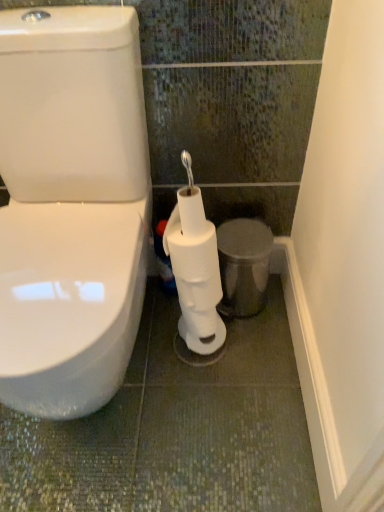
Locate an element on the screen. This screenshot has height=512, width=384. white matte toilet paper at center, which ranks as the first toilet paper in top-to-bottom order is located at coordinates (192, 252).

What do you see at coordinates (195, 272) in the screenshot? This screenshot has height=512, width=384. I see `white matte toilet paper at center, which is the 1th toilet paper from bottom to top` at bounding box center [195, 272].

Image resolution: width=384 pixels, height=512 pixels. Describe the element at coordinates (243, 265) in the screenshot. I see `metallic silver trash can at lower right` at that location.

Image resolution: width=384 pixels, height=512 pixels. In order to click on metallic silver trash can at lower right in this screenshot , I will do `click(243, 265)`.

Locate an element on the screen. The width and height of the screenshot is (384, 512). white matte toilet paper at center, which ranks as the first toilet paper in top-to-bottom order is located at coordinates click(192, 252).

Is point (235, 262) closer or farther from the camera than point (175, 271)?

Point (235, 262) is farther from the camera than point (175, 271).

From the image's perspective, which one is positioned lower, metallic silver trash can at lower right or white matte toilet paper at center, which ranks as the first toilet paper in top-to-bottom order?

metallic silver trash can at lower right, from the image's perspective.

Which object is positioned more to the right, metallic silver trash can at lower right or white matte toilet paper at center, which ranks as the first toilet paper in top-to-bottom order?

metallic silver trash can at lower right.

From a real-world perspective, is metallic silver trash can at lower right on top of white matte toilet paper at center, which ranks as the first toilet paper in top-to-bottom order?

No, from a real-world perspective, metallic silver trash can at lower right is not on top of white matte toilet paper at center, which ranks as the first toilet paper in top-to-bottom order.

Is white matte toilet paper at center, which is the 1th toilet paper from bottom to top, to the right of white matte toilet paper at center, which is counted as the second toilet paper, starting from the bottom, from the viewer's perspective?

Indeed, white matte toilet paper at center, which is the 1th toilet paper from bottom to top, is positioned on the right side of white matte toilet paper at center, which is counted as the second toilet paper, starting from the bottom.

Considering the sizes of objects white matte toilet paper at center, the 2th toilet paper when ordered from top to bottom, and white matte toilet paper at center, which ranks as the first toilet paper in top-to-bottom order, in the image provided, who is taller, white matte toilet paper at center, the 2th toilet paper when ordered from top to bottom, or white matte toilet paper at center, which ranks as the first toilet paper in top-to-bottom order,?

white matte toilet paper at center, the 2th toilet paper when ordered from top to bottom.

Which is closer to the camera, (189, 278) or (209, 259)?

Clearly, point (189, 278) is more distant from the camera than point (209, 259).

From the image's perspective, which one is positioned higher, white matte toilet paper at center, which is the 1th toilet paper from bottom to top, or white matte toilet paper at center, which ranks as the first toilet paper in top-to-bottom order?

white matte toilet paper at center, which ranks as the first toilet paper in top-to-bottom order.

From a real-world perspective, is white matte toilet paper at center, which is the 1th toilet paper from bottom to top, on metallic silver trash can at lower right?

Correct, in the physical world, white matte toilet paper at center, which is the 1th toilet paper from bottom to top, is higher than metallic silver trash can at lower right.

Which object is more forward, white matte toilet paper at center, which is the 1th toilet paper from bottom to top, or metallic silver trash can at lower right?

white matte toilet paper at center, which is the 1th toilet paper from bottom to top, is more forward.

Does white matte toilet paper at center, the 2th toilet paper when ordered from top to bottom, touch metallic silver trash can at lower right?

No, white matte toilet paper at center, the 2th toilet paper when ordered from top to bottom, is not making contact with metallic silver trash can at lower right.

Can you tell me how much white matte toilet paper at center, the 2th toilet paper when ordered from top to bottom, and metallic silver trash can at lower right differ in facing direction?

The angular difference between white matte toilet paper at center, the 2th toilet paper when ordered from top to bottom, and metallic silver trash can at lower right is 0.0641 degrees.

From the picture: From a real-world perspective, who is located higher, metallic silver trash can at lower right or white matte toilet paper at center, which is the 1th toilet paper from bottom to top?

In real-world perspective, white matte toilet paper at center, which is the 1th toilet paper from bottom to top, is above.

Consider the image. Which object is closer to the camera, metallic silver trash can at lower right or white matte toilet paper at center, the 2th toilet paper when ordered from top to bottom?

white matte toilet paper at center, the 2th toilet paper when ordered from top to bottom, is more forward.

How much distance is there between metallic silver trash can at lower right and white matte toilet paper at center, which is the 1th toilet paper from bottom to top?

The distance of metallic silver trash can at lower right from white matte toilet paper at center, which is the 1th toilet paper from bottom to top, is 7.09 inches.

At what (x,y) coordinates should I click in order to perform the action: click on porcelain lying behind the white matte toilet paper at center, which is the 1th toilet paper from bottom to top. Please return your answer as a coordinate pair (x, y). This screenshot has height=512, width=384. Looking at the image, I should click on (243, 265).

The width and height of the screenshot is (384, 512). I want to click on porcelain behind the white matte toilet paper at center, which ranks as the first toilet paper in top-to-bottom order, so click(x=243, y=265).

Looking at the image, does white matte toilet paper at center, which ranks as the first toilet paper in top-to-bottom order, seem bigger or smaller compared to metallic silver trash can at lower right?

white matte toilet paper at center, which ranks as the first toilet paper in top-to-bottom order, is smaller than metallic silver trash can at lower right.

Based on the photo, is white matte toilet paper at center, which ranks as the first toilet paper in top-to-bottom order, to the left of metallic silver trash can at lower right from the viewer's perspective?

Indeed, white matte toilet paper at center, which ranks as the first toilet paper in top-to-bottom order, is positioned on the left side of metallic silver trash can at lower right.

Does white matte toilet paper at center, which ranks as the first toilet paper in top-to-bottom order, have a lesser width compared to metallic silver trash can at lower right?

Yes, white matte toilet paper at center, which ranks as the first toilet paper in top-to-bottom order, is thinner than metallic silver trash can at lower right.

Looking at this image, does white matte toilet paper at center, which ranks as the first toilet paper in top-to-bottom order, appear on the left side of white matte toilet paper at center, the 2th toilet paper when ordered from top to bottom?

Indeed, white matte toilet paper at center, which ranks as the first toilet paper in top-to-bottom order, is positioned on the left side of white matte toilet paper at center, the 2th toilet paper when ordered from top to bottom.

Are white matte toilet paper at center, which ranks as the first toilet paper in top-to-bottom order, and white matte toilet paper at center, which is the 1th toilet paper from bottom to top, beside each other?

Absolutely, white matte toilet paper at center, which ranks as the first toilet paper in top-to-bottom order, is next to and touching white matte toilet paper at center, which is the 1th toilet paper from bottom to top.

Do you think white matte toilet paper at center, which is counted as the second toilet paper, starting from the bottom, is within white matte toilet paper at center, the 2th toilet paper when ordered from top to bottom, or outside of it?

white matte toilet paper at center, which is counted as the second toilet paper, starting from the bottom, exists entirely within white matte toilet paper at center, the 2th toilet paper when ordered from top to bottom.

Considering the sizes of objects white matte toilet paper at center, which ranks as the first toilet paper in top-to-bottom order, and white matte toilet paper at center, which is the 1th toilet paper from bottom to top, in the image provided, who is shorter, white matte toilet paper at center, which ranks as the first toilet paper in top-to-bottom order, or white matte toilet paper at center, which is the 1th toilet paper from bottom to top,?

white matte toilet paper at center, which ranks as the first toilet paper in top-to-bottom order.

At what (x,y) coordinates should I click in order to perform the action: click on the 2nd toilet paper directly above the metallic silver trash can at lower right (from a real-world perspective). Please return your answer as a coordinate pair (x, y). Looking at the image, I should click on (192, 252).

At what (x,y) coordinates should I click in order to perform the action: click on toilet paper below the white matte toilet paper at center, which is counted as the second toilet paper, starting from the bottom (from the image's perspective). Please return your answer as a coordinate pair (x, y). The image size is (384, 512). Looking at the image, I should click on click(195, 272).

Based on their spatial positions, is white matte toilet paper at center, which is the 1th toilet paper from bottom to top, or metallic silver trash can at lower right further from white matte toilet paper at center, which ranks as the first toilet paper in top-to-bottom order?

Among the two, metallic silver trash can at lower right is located further to white matte toilet paper at center, which ranks as the first toilet paper in top-to-bottom order.

Estimate the real-world distances between objects in this image. Which object is closer to white matte toilet paper at center, which is the 1th toilet paper from bottom to top, white matte toilet paper at center, which is counted as the second toilet paper, starting from the bottom, or metallic silver trash can at lower right?

white matte toilet paper at center, which is counted as the second toilet paper, starting from the bottom, is closer to white matte toilet paper at center, which is the 1th toilet paper from bottom to top.

When comparing their distances from white matte toilet paper at center, which ranks as the first toilet paper in top-to-bottom order, does metallic silver trash can at lower right or white matte toilet paper at center, which is the 1th toilet paper from bottom to top, seem further?

The object further to white matte toilet paper at center, which ranks as the first toilet paper in top-to-bottom order, is metallic silver trash can at lower right.

Estimate the real-world distances between objects in this image. Which object is further from metallic silver trash can at lower right, white matte toilet paper at center, the 2th toilet paper when ordered from top to bottom, or white matte toilet paper at center, which is counted as the second toilet paper, starting from the bottom?

Among the two, white matte toilet paper at center, the 2th toilet paper when ordered from top to bottom, is located further to metallic silver trash can at lower right.

From the image, which object appears to be farther from white matte toilet paper at center, which is the 1th toilet paper from bottom to top, metallic silver trash can at lower right or white matte toilet paper at center, which is counted as the second toilet paper, starting from the bottom?

metallic silver trash can at lower right is further to white matte toilet paper at center, which is the 1th toilet paper from bottom to top.

Consider the image. Based on their spatial positions, is white matte toilet paper at center, which is counted as the second toilet paper, starting from the bottom, or white matte toilet paper at center, the 2th toilet paper when ordered from top to bottom, closer to metallic silver trash can at lower right?

Based on the image, white matte toilet paper at center, which is counted as the second toilet paper, starting from the bottom, appears to be nearer to metallic silver trash can at lower right.

Where is `toilet paper between white matte toilet paper at center, the 2th toilet paper when ordered from top to bottom, and metallic silver trash can at lower right in the front-back direction`? toilet paper between white matte toilet paper at center, the 2th toilet paper when ordered from top to bottom, and metallic silver trash can at lower right in the front-back direction is located at coordinates (192, 252).